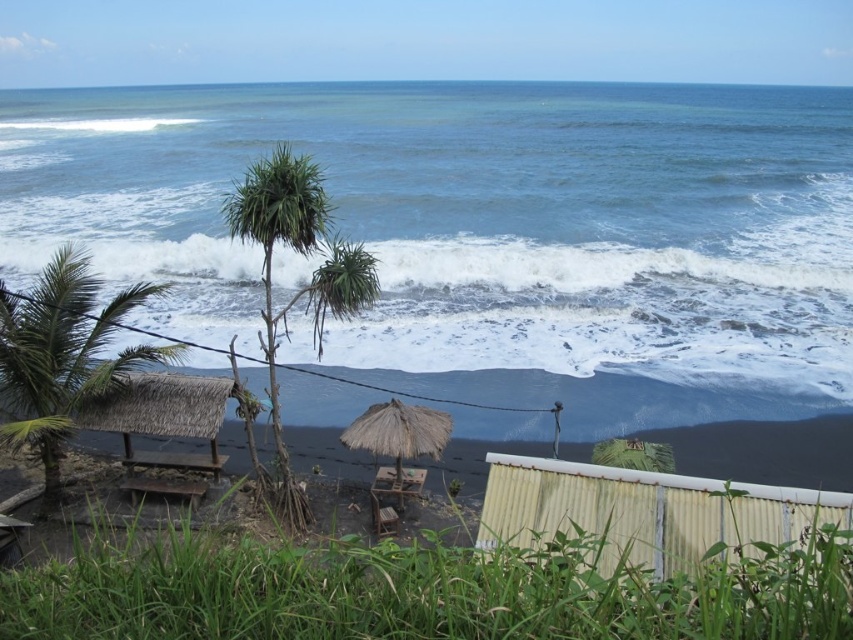
Question: Which object appears farthest from the camera in this image?

Choices:
 (A) green leafy palm tree at center-left
 (B) yellow corrugated metal hut at lower right
 (C) thatched straw umbrella at center

Answer: (C)

Question: Which point appears closest to the camera in this image?

Choices:
 (A) (428, 445)
 (B) (409, 260)

Answer: (A)

Question: Does yellow corrugated metal hut at lower right have a lesser width compared to green leafy palm tree at center-left?

Choices:
 (A) yes
 (B) no

Answer: (A)

Question: Is yellow corrugated metal hut at lower right smaller than green leafy palm tree at lower left?

Choices:
 (A) yes
 (B) no

Answer: (A)

Question: Can you confirm if white frothy wave at center is smaller than thatched straw umbrella at center?

Choices:
 (A) yes
 (B) no

Answer: (B)

Question: Which point is closer to the camera taking this photo?

Choices:
 (A) (231, 212)
 (B) (132, 410)
 (C) (354, 436)
 (D) (764, 298)

Answer: (A)